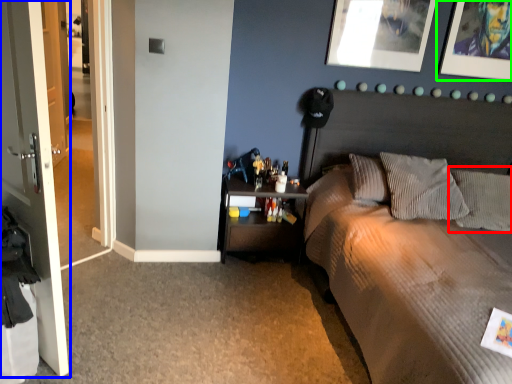
Question: Estimate the real-world distances between objects in this image. Which object is farther from pillow (highlighted by a red box), door (highlighted by a blue box) or picture frame (highlighted by a green box)?

Choices:
 (A) door
 (B) picture frame

Answer: (A)